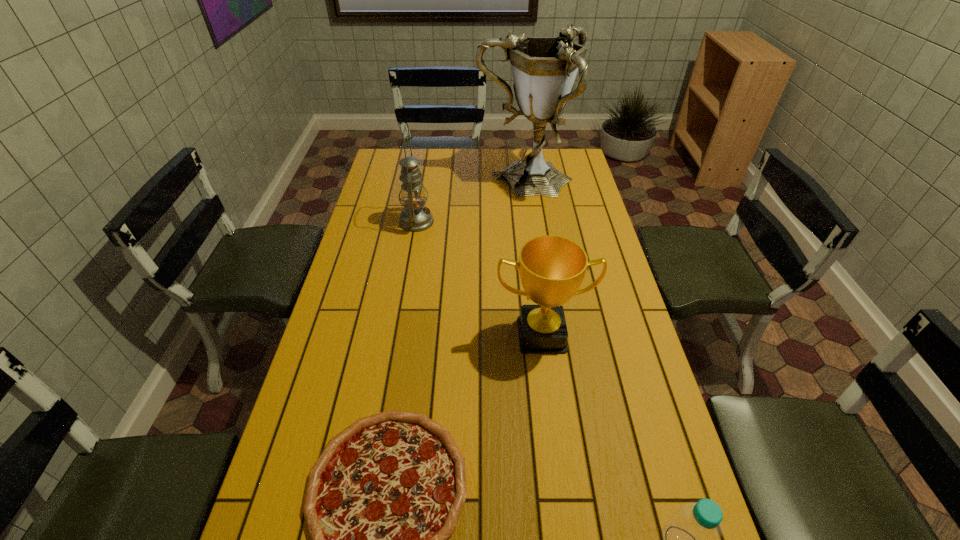
This screenshot has height=540, width=960. What are the coordinates of `award that is at the right edge` in the screenshot? It's located at (552, 268).

In order to click on object present at the far right corner in this screenshot , I will do `click(544, 69)`.

Locate an element on the screen. Image resolution: width=960 pixels, height=540 pixels. blank space at the left edge is located at coordinates 370,278.

The width and height of the screenshot is (960, 540). What are the coordinates of `vacant area at the right edge` in the screenshot? It's located at (639, 524).

Where is `free location at the far left corner`? Image resolution: width=960 pixels, height=540 pixels. free location at the far left corner is located at coordinates (394, 148).

Identify the location of free space at the far right corner. Image resolution: width=960 pixels, height=540 pixels. (581, 163).

The image size is (960, 540). What are the coordinates of `free space between the second tallest object and the third shortest object` in the screenshot? It's located at (479, 278).

Locate an element on the screen. object that is the third closest to the oil lamp is located at coordinates (386, 493).

Choose which object is the third nearest neighbor to the tallest object. Please provide its 2D coordinates. Your answer should be formatted as a tuple, i.e. [(x, y)], where the tuple contains the x and y coordinates of a point satisfying the conditions above.

[(386, 493)]